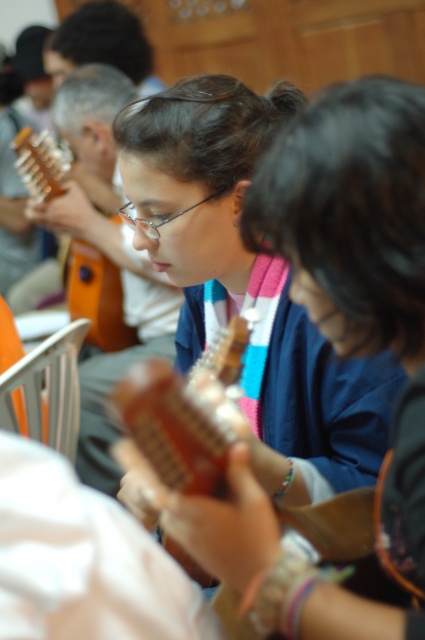
You are a photographer setting up for a music class photo shoot. You need to position a microphone stand between the wooden acoustic guitar at center and the matte brown guitar at left. Based on their positions, which guitar should the microphone stand be placed closer to?

The microphone stand should be placed closer to the wooden acoustic guitar at center because it is positioned below the matte brown guitar at left, meaning it is lower in the image and the microphone stand would need to be closer to accommodate the lower placement.

In the music class scene, there is a wooden acoustic guitar at center and a matte brown guitar at left. Which guitar is positioned to the right of the other?

The wooden acoustic guitar at center is positioned to the right of the matte brown guitar at left.